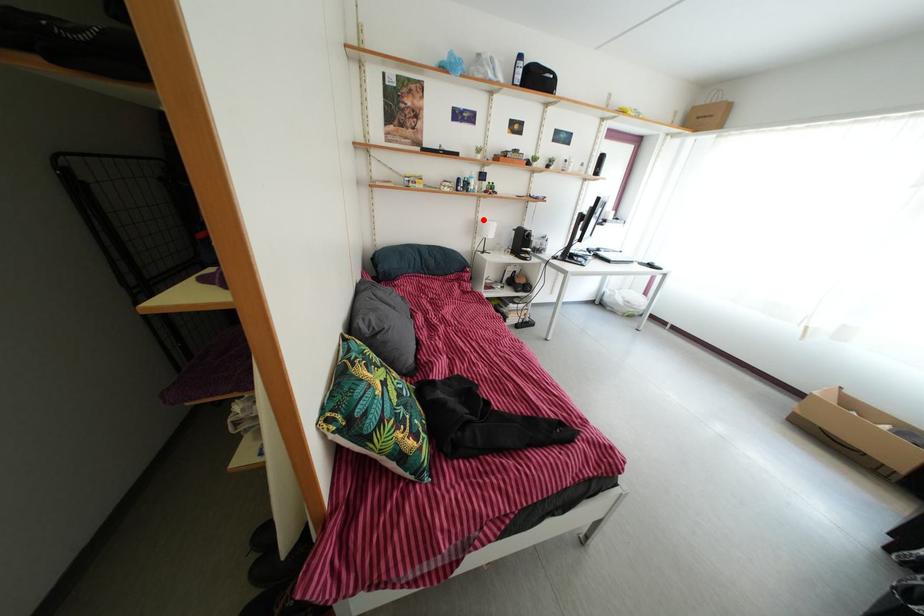
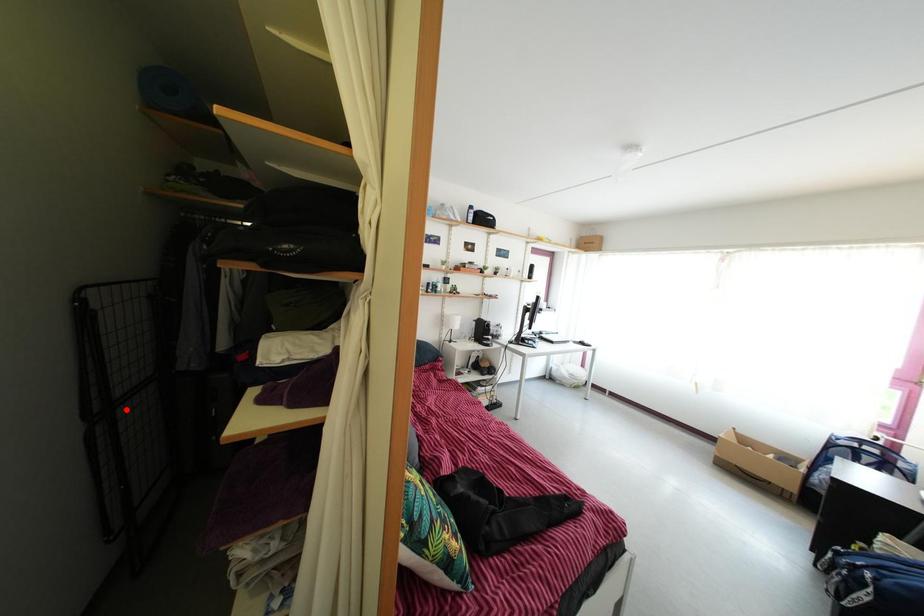
I am providing you with two images of the same scene from different viewpoints. A red point is marked on the first image and another point is marked on the second image. Do the highlighted points in image1 and image2 indicate the same real-world spot?

No